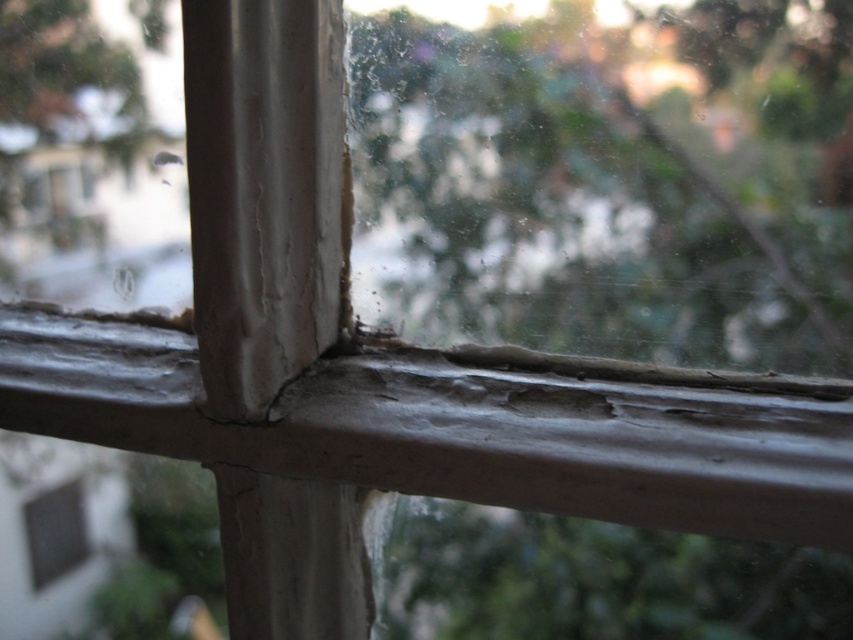
Based on the scene described, which object between the green leafy tree at center and the matte gray window at lower left is taller?

The green leafy tree at center is taller than the matte gray window at lower left according to the description.

You are looking at the window frame and notice two points marked on it. The first point is at coordinates point (735, 138) and the second is at point (48, 525). From your perspective, which point appears closer to you?

Point (735, 138) is in front of point (48, 525), so it appears closer to you.